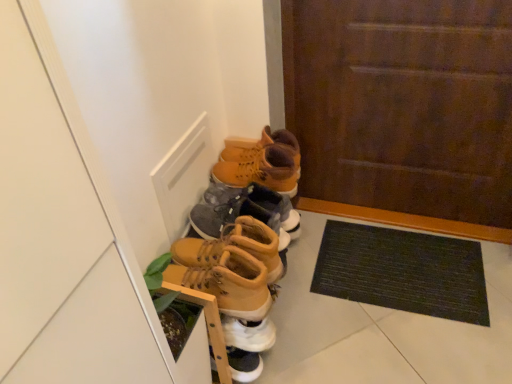
Question: Which is correct: matte brown boot at center, acting as the fourth footwear starting from the top, is inside leather tan boots at center, which is the first footwear in bottom-to-top order, or outside of it?

Choices:
 (A) outside
 (B) inside

Answer: (A)

Question: Considering the relative positions of matte brown boot at center, acting as the fourth footwear starting from the top, and leather tan boots at center, the 5th footwear viewed from the top, in the image provided, is matte brown boot at center, acting as the fourth footwear starting from the top, to the left or to the right of leather tan boots at center, the 5th footwear viewed from the top,?

Choices:
 (A) right
 (B) left

Answer: (A)

Question: Considering the real-world distances, which object is farthest from the leather tan boots at center, which is the first footwear in bottom-to-top order?

Choices:
 (A) matte yellow leather boots at center, the fifth footwear ordered from the bottom
 (B) brown wooden door at center
 (C) leather tan boots at center, the third footwear in the top-to-bottom sequence
 (D) matte yellow boots at center, which ranks as the 2th footwear in top-to-bottom order
 (E) black rubber doormat at lower right

Answer: (B)

Question: Which is nearer to the leather tan boots at center, the 5th footwear viewed from the top?

Choices:
 (A) black rubber doormat at lower right
 (B) matte yellow leather boots at center, positioned as the first footwear in top-to-bottom order
 (C) matte brown boot at center, acting as the fourth footwear starting from the top
 (D) leather tan boots at center, which ranks as the third footwear in bottom-to-top order
 (E) matte yellow boots at center, which is the 4th footwear from bottom to top

Answer: (D)